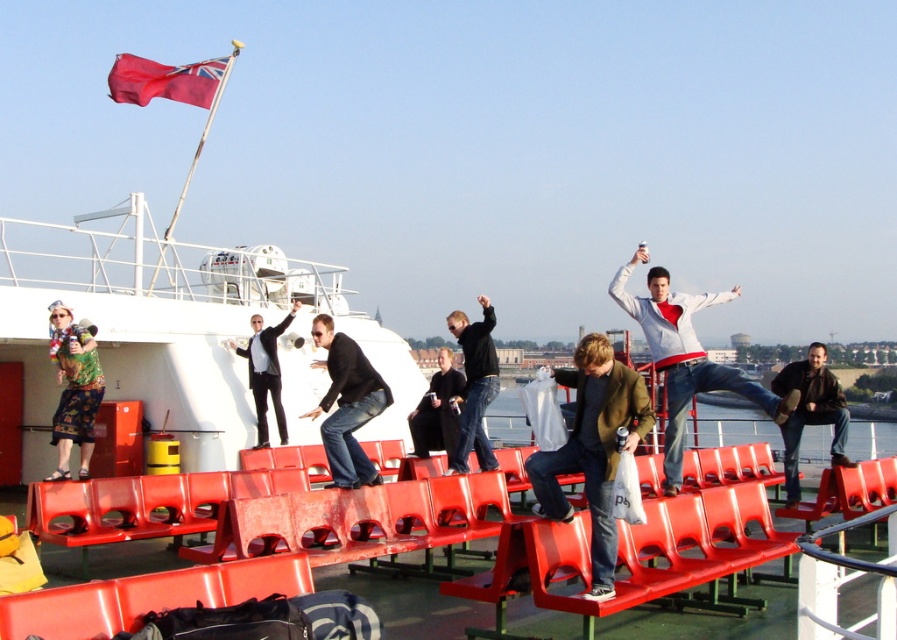
Does white matte jacket at upper center appear on the right side of black smooth suit at center?

Yes, white matte jacket at upper center is to the right of black smooth suit at center.

Is point (673, 380) more distant than point (292, 317)?

No, (673, 380) is closer to viewer.

Where is `white matte jacket at upper center`? The width and height of the screenshot is (897, 640). white matte jacket at upper center is located at coordinates (685, 356).

Between black leather jacket at center and red fabric flag at upper left, which one is positioned higher?

red fabric flag at upper left

Looking at this image, is black leather jacket at center smaller than red fabric flag at upper left?

Yes, black leather jacket at center is smaller than red fabric flag at upper left.

Locate an element on the screen. This screenshot has height=640, width=897. black leather jacket at center is located at coordinates (475, 387).

Does matte brown jacket at center have a greater height compared to red fabric flag at upper left?

Incorrect, matte brown jacket at center's height is not larger of red fabric flag at upper left's.

Can you confirm if matte brown jacket at center is shorter than red fabric flag at upper left?

Indeed, matte brown jacket at center has a lesser height compared to red fabric flag at upper left.

At what (x,y) coordinates should I click in order to perform the action: click on matte brown jacket at center. Please return your answer as a coordinate pair (x, y). The width and height of the screenshot is (897, 640). Looking at the image, I should click on (593, 449).